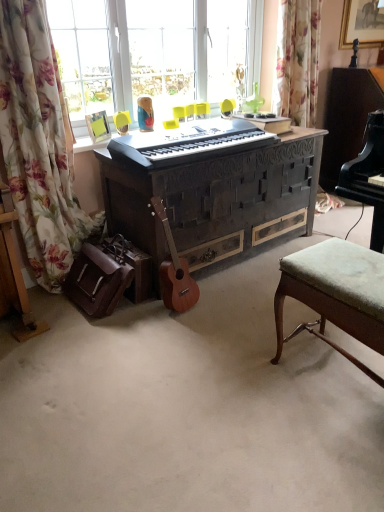
Question: From a real-world perspective, is dark wood carved desk at center positioned over wooden acoustic guitar at lower left based on gravity?

Choices:
 (A) yes
 (B) no

Answer: (A)

Question: Can you confirm if dark wood carved desk at center is shorter than wooden acoustic guitar at lower left?

Choices:
 (A) yes
 (B) no

Answer: (B)

Question: Can you confirm if dark wood carved desk at center is wider than wooden acoustic guitar at lower left?

Choices:
 (A) no
 (B) yes

Answer: (B)

Question: Does dark wood carved desk at center lie in front of wooden acoustic guitar at lower left?

Choices:
 (A) yes
 (B) no

Answer: (B)

Question: From the image's perspective, does dark wood carved desk at center appear higher than wooden acoustic guitar at lower left?

Choices:
 (A) no
 (B) yes

Answer: (B)

Question: Is dark wood carved desk at center taller than wooden acoustic guitar at lower left?

Choices:
 (A) no
 (B) yes

Answer: (B)

Question: Is floral fabric curtain at left surrounding yellow plastic swivel chair at center?

Choices:
 (A) yes
 (B) no

Answer: (B)

Question: Considering the relative positions of floral fabric curtain at left and yellow plastic swivel chair at center in the image provided, is floral fabric curtain at left to the right of yellow plastic swivel chair at center from the viewer's perspective?

Choices:
 (A) yes
 (B) no

Answer: (B)

Question: Is floral fabric curtain at left closer to camera compared to yellow plastic swivel chair at center?

Choices:
 (A) no
 (B) yes

Answer: (B)

Question: Can you see floral fabric curtain at left touching yellow plastic swivel chair at center?

Choices:
 (A) no
 (B) yes

Answer: (A)

Question: From the image's perspective, is floral fabric curtain at left under yellow plastic swivel chair at center?

Choices:
 (A) no
 (B) yes

Answer: (B)

Question: Is floral fabric curtain at left not near yellow plastic swivel chair at center?

Choices:
 (A) no
 (B) yes

Answer: (B)

Question: Can yellow plastic swivel chair at center be found inside green fabric stool at lower right?

Choices:
 (A) no
 (B) yes

Answer: (A)